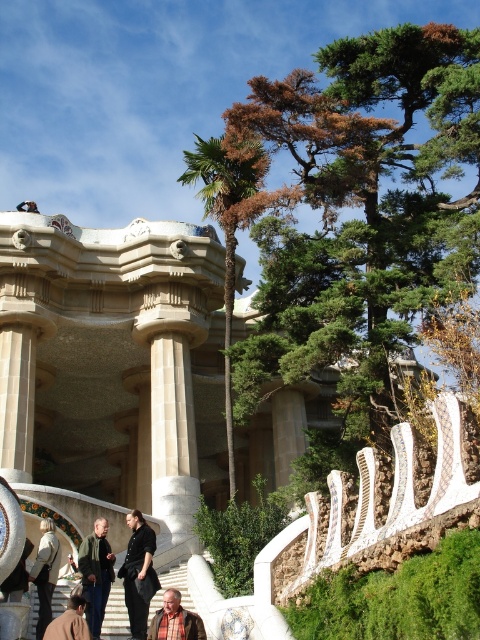
You are standing at the entrance of Park Gaud?l and want to locate the green leafy palm tree at center. According to the coordinates provided, where should you look?

The green leafy palm tree at center is located at point (226, 228).

You are standing at the bottom of the stairs in Park Gaud? looking up. You see a green leafy palm tree at center and a brown plaid shirt at lower center. Which object is positioned more to the left from your viewpoint?

The green leafy palm tree at center is positioned more to the left from your viewpoint since it is to the left of the brown plaid shirt at lower center.